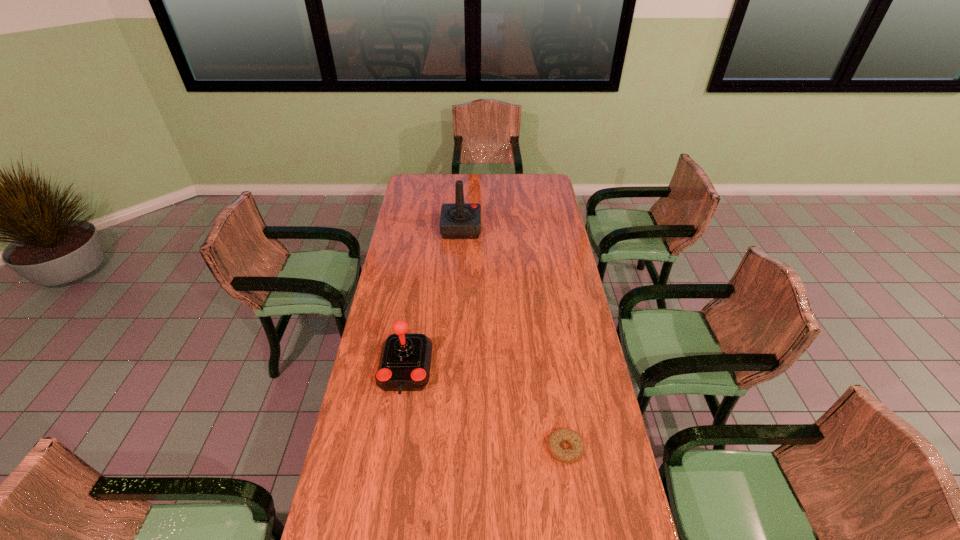
Where is `the tallest object`? The height and width of the screenshot is (540, 960). the tallest object is located at coordinates (459, 220).

Where is `the taller joystick`? This screenshot has height=540, width=960. the taller joystick is located at coordinates (459, 220).

Identify the location of the shorter joystick. (405, 360).

I want to click on the nearer joystick, so click(405, 360).

This screenshot has height=540, width=960. I want to click on bagel, so coord(558,436).

Locate an element on the screen. Image resolution: width=960 pixels, height=540 pixels. the nearest object is located at coordinates (558, 436).

This screenshot has height=540, width=960. What are the coordinates of `vacant space situated 0.220m on the front-facing side of the farthest object` in the screenshot? It's located at (524, 228).

Locate an element on the screen. The height and width of the screenshot is (540, 960). vacant region located on the base of the nearer joystick is located at coordinates (398, 418).

Identify the location of vacant area situated on the front of the nearest object. (570, 485).

Where is `object at the left edge`? Image resolution: width=960 pixels, height=540 pixels. object at the left edge is located at coordinates (405, 360).